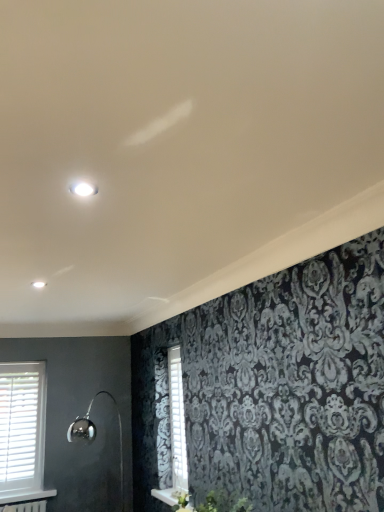
Question: Considering their positions, is white wooden shutter at center located in front of or behind white wooden window at lower left?

Choices:
 (A) behind
 (B) front

Answer: (B)

Question: Considering the positions of white wooden shutter at center and white wooden window at lower left in the image, is white wooden shutter at center bigger or smaller than white wooden window at lower left?

Choices:
 (A) big
 (B) small

Answer: (B)

Question: Estimate the real-world distances between objects in this image. Which object is farther from the polished chrome shower at lower left?

Choices:
 (A) white wooden shutter at center
 (B) white wooden window at lower left

Answer: (A)

Question: Considering the real-world distances, which object is closest to the white wooden shutter at center?

Choices:
 (A) polished chrome shower at lower left
 (B) white wooden window at lower left

Answer: (A)